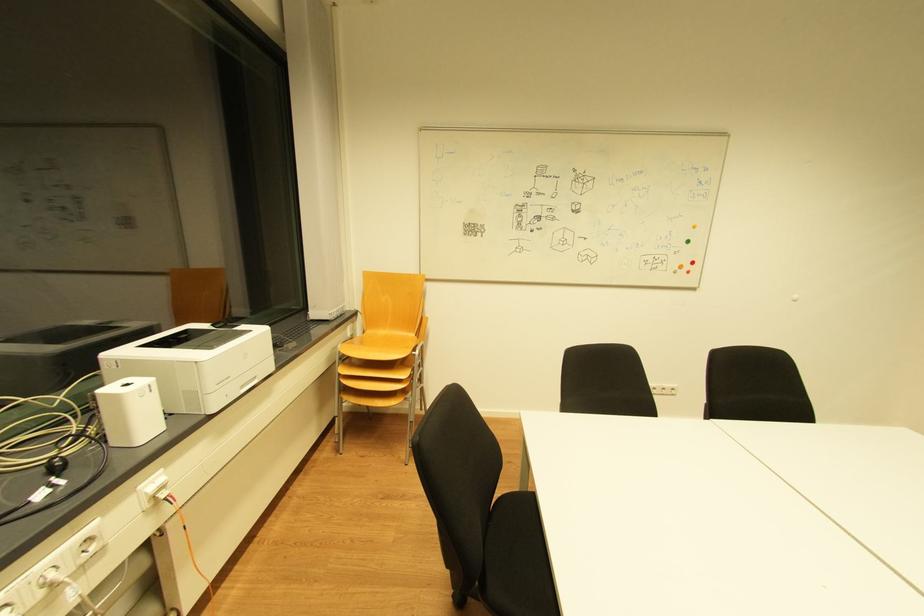
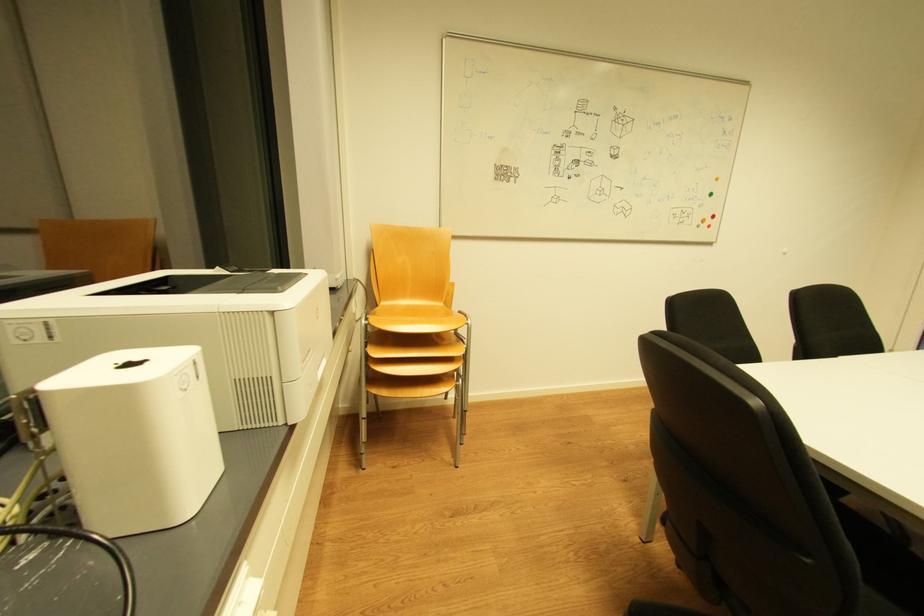
What movement of the cameraman would produce the second image?

The cameraman moved toward left, forward.